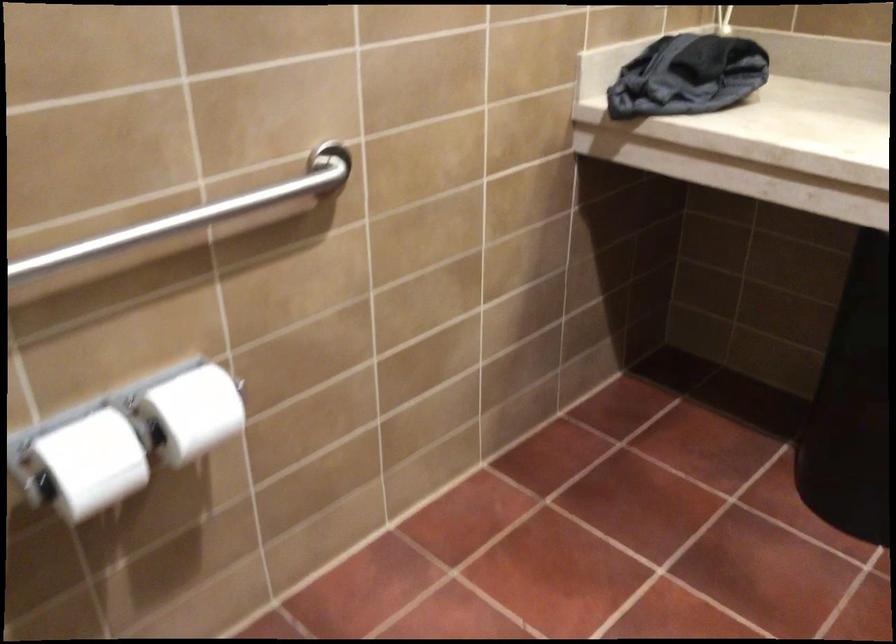
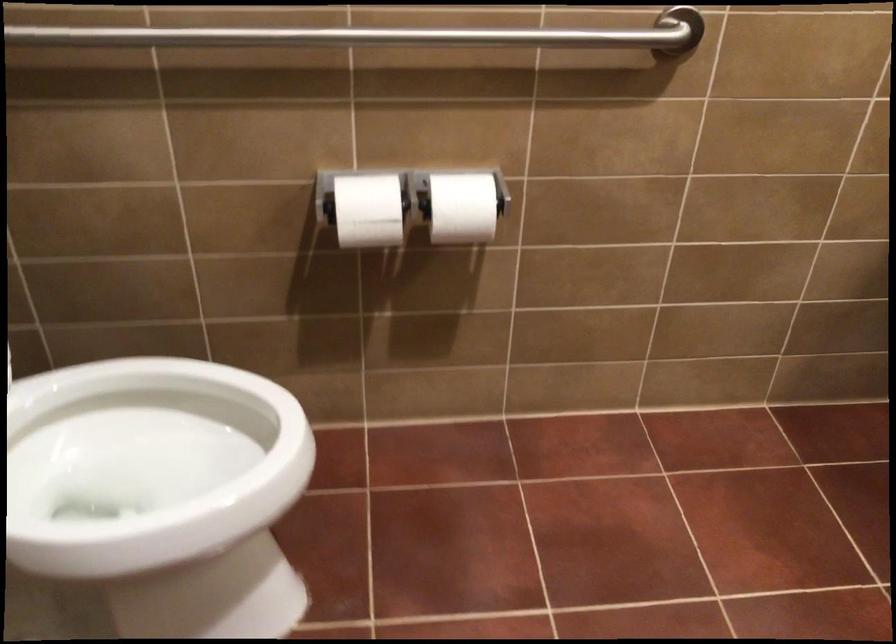
In the second image, find the point that corresponds to pixel 207 412 in the first image.

(462, 207)